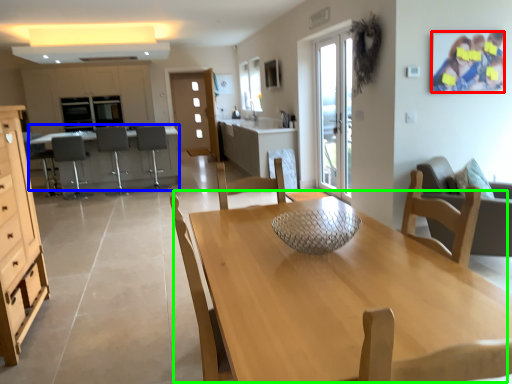
Question: Estimate the real-world distances between objects in this image. Which object is closer to couple (highlighted by a red box), desk (highlighted by a blue box) or kitchen & dining room table (highlighted by a green box)?

Choices:
 (A) desk
 (B) kitchen & dining room table

Answer: (B)